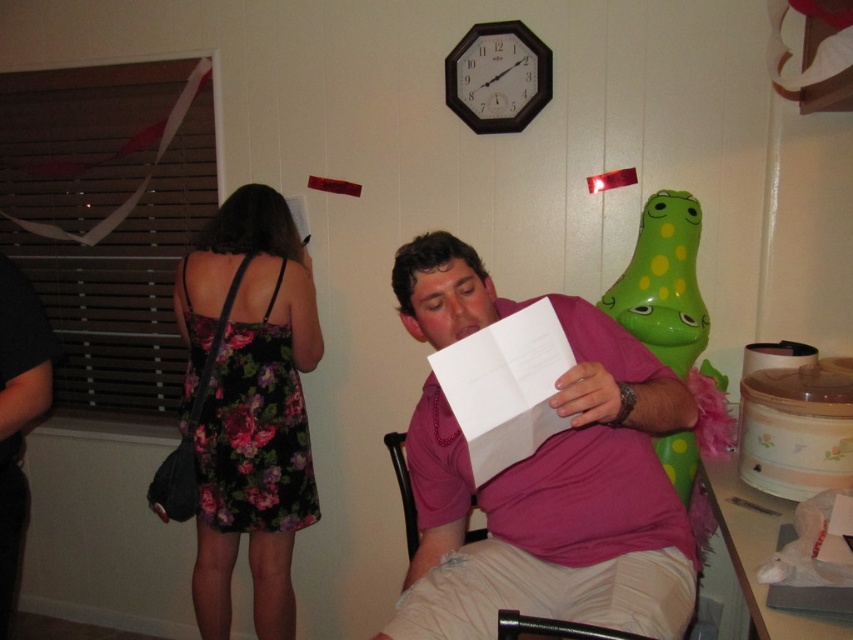
Is point (543, 84) behind point (526, 632)?

Yes, point (543, 84) is behind point (526, 632).

Looking at this image, does black plastic clock at upper center appear over metallic black chair at lower center?

Correct, black plastic clock at upper center is located above metallic black chair at lower center.

Measure the distance between point (521, 76) and camera.

A distance of 7.24 feet exists between point (521, 76) and camera.

At what (x,y) coordinates should I click in order to perform the action: click on black plastic clock at upper center. Please return your answer as a coordinate pair (x, y). The height and width of the screenshot is (640, 853). Looking at the image, I should click on (498, 76).

Does green rubber duck at right appear over wooden chair at center?

Yes, green rubber duck at right is above wooden chair at center.

Can you confirm if green rubber duck at right is positioned to the left of wooden chair at center?

Incorrect, green rubber duck at right is not on the left side of wooden chair at center.

This screenshot has height=640, width=853. What do you see at coordinates (663, 282) in the screenshot? I see `green rubber duck at right` at bounding box center [663, 282].

At what (x,y) coordinates should I click in order to perform the action: click on green rubber duck at right. Please return your answer as a coordinate pair (x, y). The width and height of the screenshot is (853, 640). Looking at the image, I should click on (663, 282).

Who is taller, floral dress at left or black plastic clock at upper center?

With more height is floral dress at left.

Does floral dress at left appear on the right side of black plastic clock at upper center?

In fact, floral dress at left is to the left of black plastic clock at upper center.

Does point (271, 609) lie behind point (477, 68)?

Yes.

Where is `floral dress at left`? The height and width of the screenshot is (640, 853). floral dress at left is located at coordinates (248, 404).